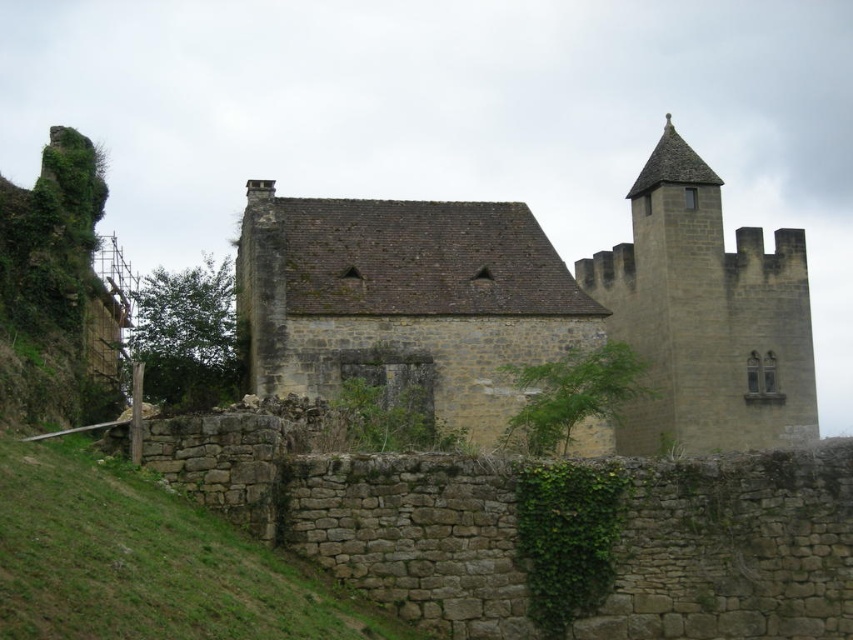
Does brown stone tower at upper right appear under green leafy ivy at center?

Incorrect, brown stone tower at upper right is not positioned below green leafy ivy at center.

Locate an element on the screen. brown stone tower at upper right is located at coordinates (705, 317).

Where is `brown stone tower at upper right`? This screenshot has width=853, height=640. brown stone tower at upper right is located at coordinates (705, 317).

Does point (334, 248) come behind point (689, 304)?

No, it is in front of (689, 304).

From the picture: Between brown stone castle at center and brown stone tower at upper right, which one appears on the left side from the viewer's perspective?

From the viewer's perspective, brown stone castle at center appears more on the left side.

The width and height of the screenshot is (853, 640). What are the coordinates of `brown stone castle at center` in the screenshot? It's located at (541, 307).

Find the location of a particular element. The height and width of the screenshot is (640, 853). brown stone castle at center is located at coordinates (541, 307).

Can you confirm if brown stone castle at center is positioned to the left of green leafy ivy at center?

Result: Indeed, brown stone castle at center is positioned on the left side of green leafy ivy at center.

From the picture: Measure the distance between brown stone castle at center and camera.

brown stone castle at center and camera are 78.15 meters apart from each other.

Identify the location of brown stone castle at center. The image size is (853, 640). (541, 307).